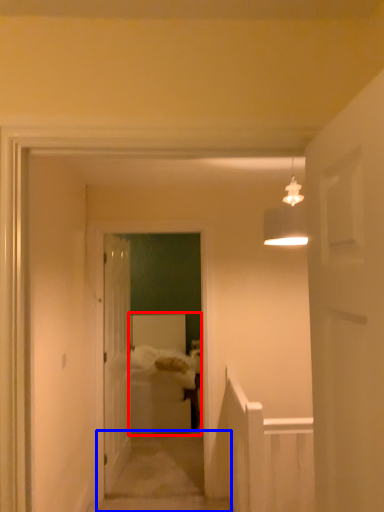
Question: Which object appears closest to the camera in this image, bed (highlighted by a red box) or path (highlighted by a blue box)?

Choices:
 (A) bed
 (B) path

Answer: (B)